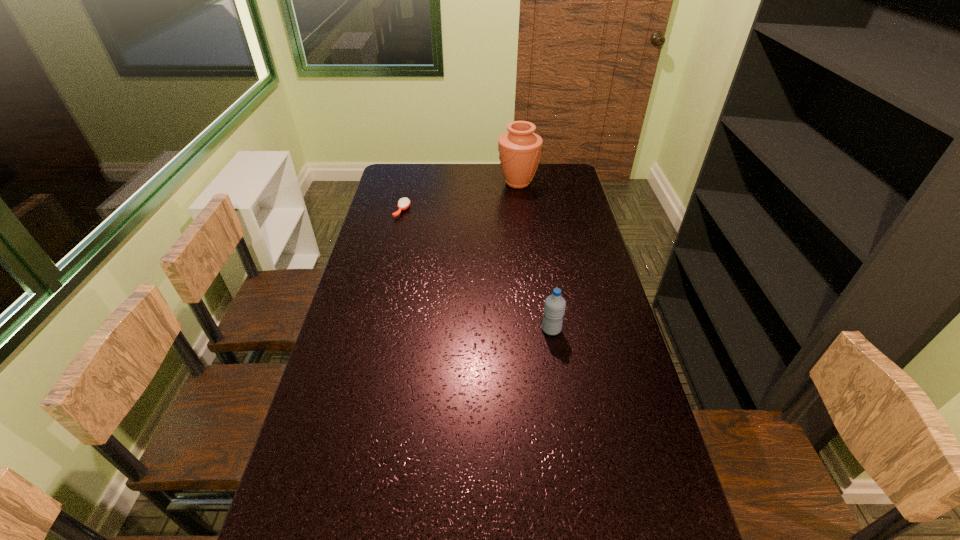
Locate an element on the screen. The image size is (960, 540). the tallest object is located at coordinates (519, 149).

Locate an element on the screen. The width and height of the screenshot is (960, 540). the farthest object is located at coordinates (519, 149).

At what (x,y) coordinates should I click in order to perform the action: click on the nearest object. Please return your answer as a coordinate pair (x, y). This screenshot has height=540, width=960. Looking at the image, I should click on (554, 307).

At what (x,y) coordinates should I click in order to perform the action: click on the second shortest object. Please return your answer as a coordinate pair (x, y). Looking at the image, I should click on (554, 307).

Find the location of a particular element. This screenshot has height=540, width=960. the second nearest object is located at coordinates (403, 203).

What are the coordinates of `the leftmost object` in the screenshot? It's located at (403, 203).

You are a GUI agent. You are given a task and a screenshot of the screen. Output one action in this format:
    pyautogui.click(x=<x>, y=<y>)
    Task: Click on the vacant space positioned 0.140m on the front of the farthest object
    
    Given the screenshot: What is the action you would take?
    pyautogui.click(x=521, y=212)

In order to click on free space located 0.370m on the front of the nearest object in this screenshot , I will do `click(571, 458)`.

At what (x,y) coordinates should I click in order to perform the action: click on vacant region located on the back of the hairbrush. Please return your answer as a coordinate pair (x, y). This screenshot has height=540, width=960. Looking at the image, I should click on (413, 164).

The height and width of the screenshot is (540, 960). What are the coordinates of `object that is at the far edge` in the screenshot? It's located at (519, 149).